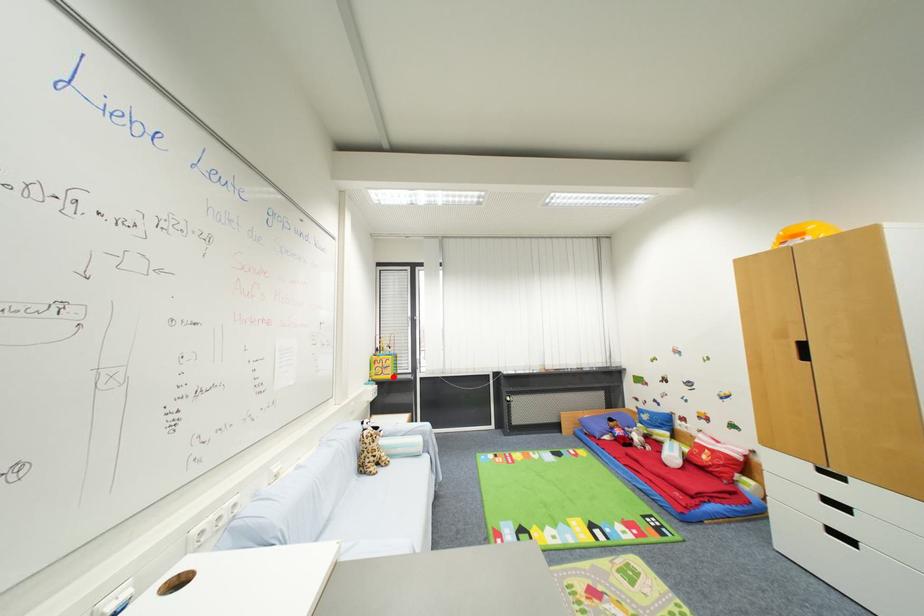
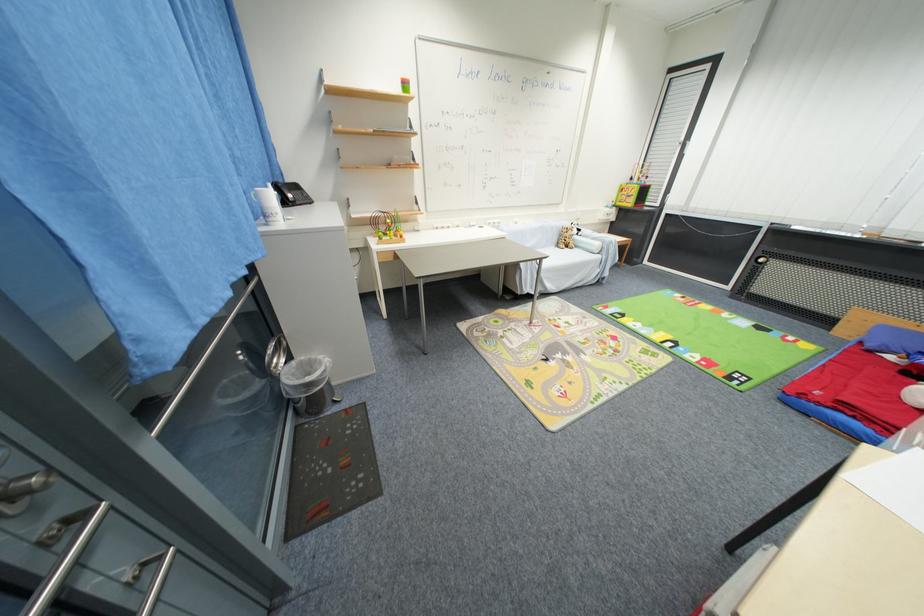
Question: I am providing you with two images of the same scene from different viewpoints. Image1 has a red point marked. In image2, the corresponding 3D location appears at what relative position? Reply with the corresponding letter.

Choices:
 (A) Closer
 (B) Farther

Answer: (A)